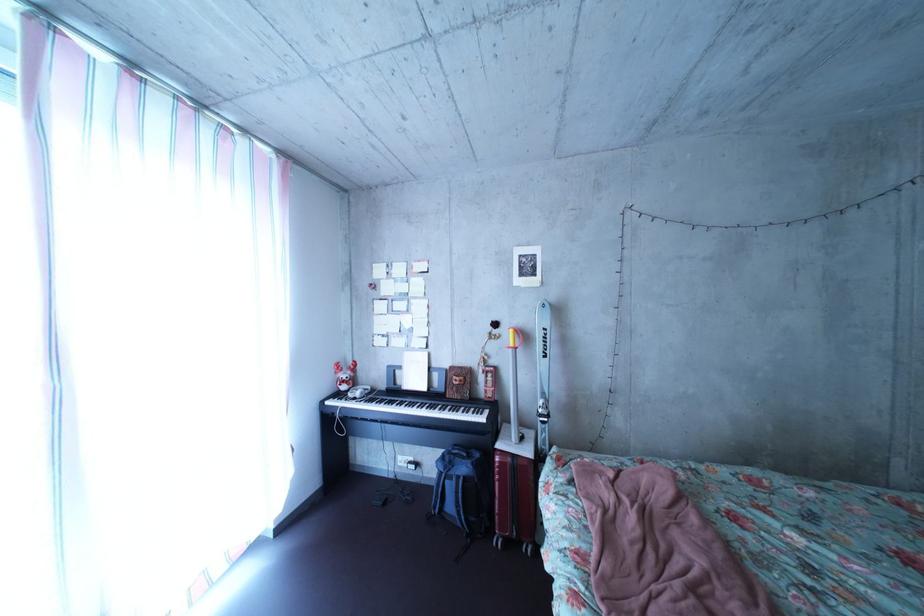
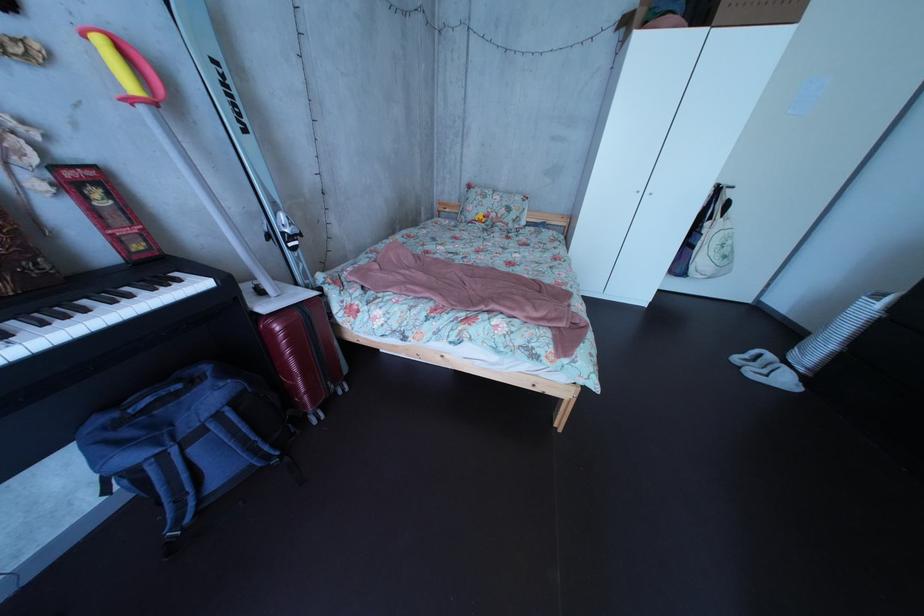
Where in the second image is the point corresponding to point 526,339 from the first image?

(116, 51)